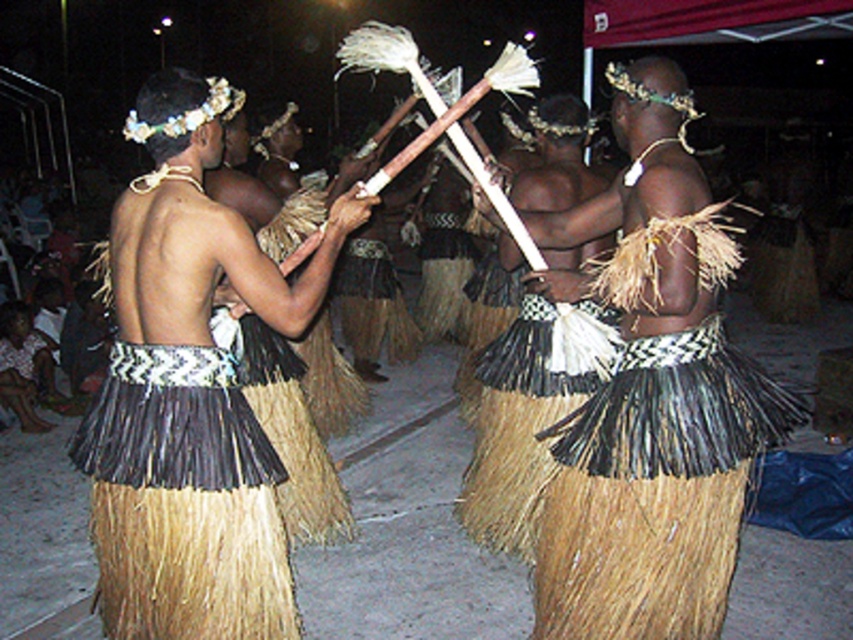
Question: Does natural straw skirt at center have a lesser width compared to black woven grass skirt at center?

Choices:
 (A) yes
 (B) no

Answer: (B)

Question: Is natural straw skirt at center to the right of black woven grass skirt at center from the viewer's perspective?

Choices:
 (A) no
 (B) yes

Answer: (B)

Question: Is natural straw skirt at center wider than black woven grass skirt at center?

Choices:
 (A) no
 (B) yes

Answer: (B)

Question: Which point is farther to the camera?

Choices:
 (A) black woven grass skirt at center
 (B) natural straw skirt at center

Answer: (A)